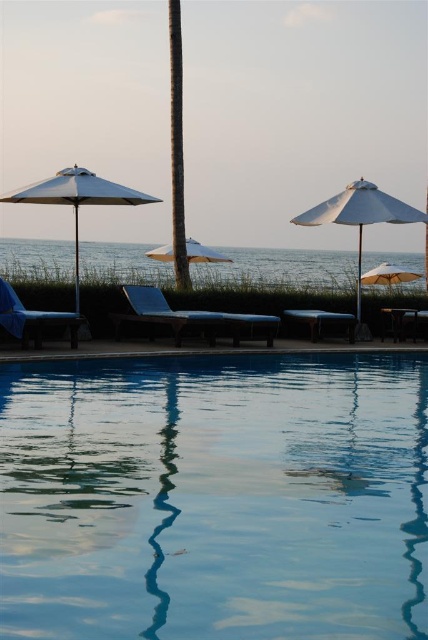
Between brown textured pole at center and matte blue beach chair at center, which one appears on the right side from the viewer's perspective?

From the viewer's perspective, matte blue beach chair at center appears more on the right side.

Who is lower down, brown textured pole at center or matte blue beach chair at center?

matte blue beach chair at center is below.

Which is behind, point (178, 20) or point (303, 321)?

Point (178, 20)

Locate an element on the screen. The height and width of the screenshot is (640, 428). brown textured pole at center is located at coordinates (177, 148).

Does point (92, 413) come behind point (24, 321)?

No.

Between transparent glass pool at center and matte blue beach chair at left, which one has more height?

matte blue beach chair at left

Is point (317, 380) closer to camera compared to point (23, 330)?

Yes, it is in front of point (23, 330).

At what (x,y) coordinates should I click in order to perform the action: click on transparent glass pool at center. Please return your answer as a coordinate pair (x, y). The height and width of the screenshot is (640, 428). Looking at the image, I should click on (214, 497).

Is transparent glass pool at center to the right of matte blue beach chair at center from the viewer's perspective?

Incorrect, transparent glass pool at center is not on the right side of matte blue beach chair at center.

You are a GUI agent. You are given a task and a screenshot of the screen. Output one action in this format:
    pyautogui.click(x=<x>, y=<y>)
    Task: Click on the transparent glass pool at center
    
    Given the screenshot: What is the action you would take?
    pyautogui.click(x=214, y=497)

What are the coordinates of `transparent glass pool at center` in the screenshot? It's located at (214, 497).